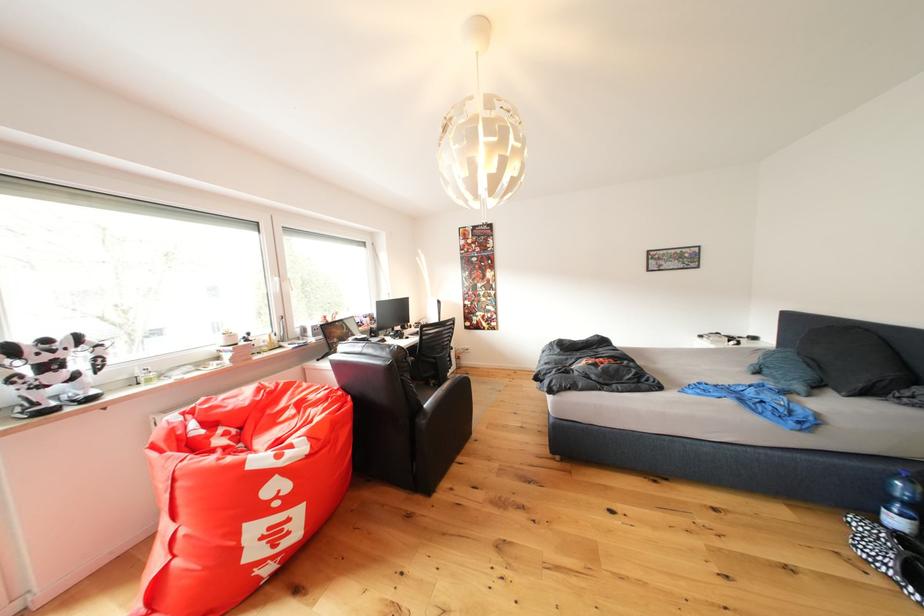
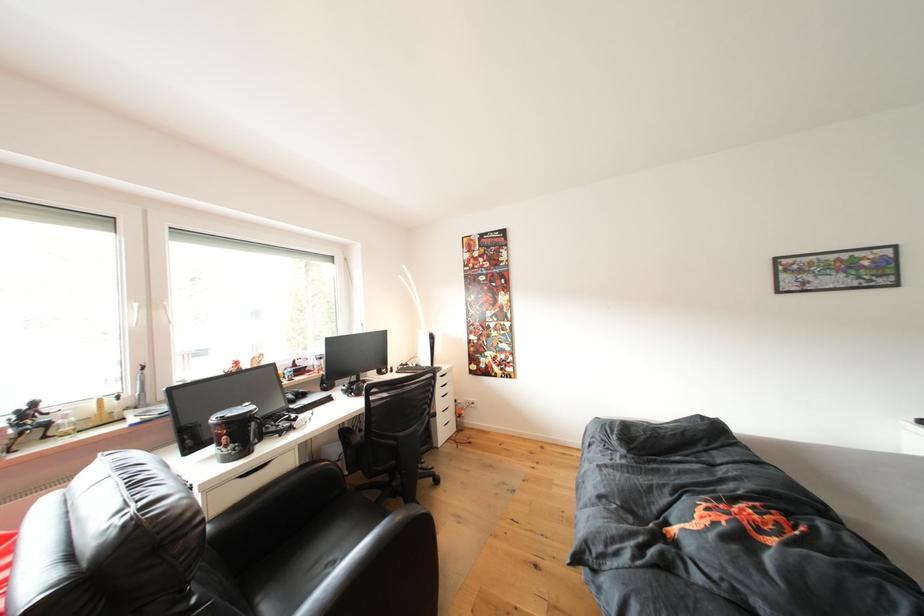
Question: The images are taken continuously from a first-person perspective. In which direction are you moving?

Choices:
 (A) Left
 (B) Right
 (C) Forward
 (D) Backward

Answer: (C)